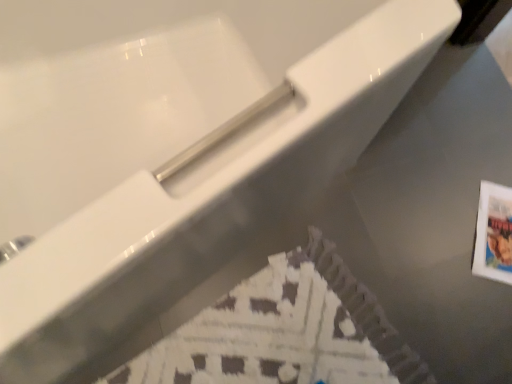
What do you see at coordinates (493, 234) in the screenshot? This screenshot has width=512, height=384. I see `printed paper postcard at lower right` at bounding box center [493, 234].

Find the location of a particular element. printed paper postcard at lower right is located at coordinates coord(493,234).

This screenshot has height=384, width=512. In order to click on white paper flyer at lower center in this screenshot , I will do `click(284, 332)`.

What do you see at coordinates (284, 332) in the screenshot?
I see `white paper flyer at lower center` at bounding box center [284, 332].

Find the location of a particular element. This screenshot has width=512, height=384. printed paper postcard at lower right is located at coordinates [x=493, y=234].

Does white paper flyer at lower center appear on the left side of printed paper postcard at lower right?

Yes, white paper flyer at lower center is to the left of printed paper postcard at lower right.

Between white paper flyer at lower center and printed paper postcard at lower right, which one is positioned in front?

white paper flyer at lower center is closer to the camera.

Considering the positions of point (318, 302) and point (489, 255), is point (318, 302) closer or farther from the camera than point (489, 255)?

Clearly, point (318, 302) is closer to the camera than point (489, 255).

From the image's perspective, which one is positioned higher, white paper flyer at lower center or printed paper postcard at lower right?

printed paper postcard at lower right, from the image's perspective.

From a real-world perspective, relative to printed paper postcard at lower right, is white paper flyer at lower center vertically above or below?

Clearly, from a real-world perspective, white paper flyer at lower center is above printed paper postcard at lower right.

Is white paper flyer at lower center thinner than printed paper postcard at lower right?

No.

Is white paper flyer at lower center taller than printed paper postcard at lower right?

Yes, white paper flyer at lower center is taller than printed paper postcard at lower right.

Considering the sizes of white paper flyer at lower center and printed paper postcard at lower right in the image, is white paper flyer at lower center bigger or smaller than printed paper postcard at lower right?

Considering their sizes, white paper flyer at lower center takes up more space than printed paper postcard at lower right.

Is printed paper postcard at lower right located within white paper flyer at lower center?

No, printed paper postcard at lower right is not inside white paper flyer at lower center.

Is white paper flyer at lower center placed right next to printed paper postcard at lower right?

white paper flyer at lower center is not next to printed paper postcard at lower right, and they're not touching.

Is white paper flyer at lower center turned away from printed paper postcard at lower right?

white paper flyer at lower center is not turned away from printed paper postcard at lower right.

Measure the distance from white paper flyer at lower center to printed paper postcard at lower right.

A distance of 21.31 inches exists between white paper flyer at lower center and printed paper postcard at lower right.

Locate an element on the screen. Image resolution: width=512 pixels, height=384 pixels. postcard below the white paper flyer at lower center (from a real-world perspective) is located at coordinates (493, 234).

Is printed paper postcard at lower right at the left side of white paper flyer at lower center?

No, printed paper postcard at lower right is not to the left of white paper flyer at lower center.

Does printed paper postcard at lower right come behind white paper flyer at lower center?

That is True.

Does point (506, 254) appear closer or farther from the camera than point (185, 378)?

Point (506, 254) is positioned farther from the camera compared to point (185, 378).

From the picture: From the image's perspective, is printed paper postcard at lower right above white paper flyer at lower center?

Correct, printed paper postcard at lower right appears higher than white paper flyer at lower center in the image.

From a real-world perspective, who is located higher, printed paper postcard at lower right or white paper flyer at lower center?

In real-world perspective, white paper flyer at lower center is above.

In terms of width, does printed paper postcard at lower right look wider or thinner when compared to white paper flyer at lower center?

In the image, printed paper postcard at lower right appears to be more narrow than white paper flyer at lower center.

Considering the relative sizes of printed paper postcard at lower right and white paper flyer at lower center in the image provided, is printed paper postcard at lower right shorter than white paper flyer at lower center?

Correct, printed paper postcard at lower right is not as tall as white paper flyer at lower center.

Considering the sizes of objects printed paper postcard at lower right and white paper flyer at lower center in the image provided, who is smaller, printed paper postcard at lower right or white paper flyer at lower center?

With smaller size is printed paper postcard at lower right.

Would you say printed paper postcard at lower right is inside or outside white paper flyer at lower center?

printed paper postcard at lower right exists outside the volume of white paper flyer at lower center.

Is printed paper postcard at lower right not near white paper flyer at lower center?

No, there isn't a large distance between printed paper postcard at lower right and white paper flyer at lower center.

Is printed paper postcard at lower right facing towards white paper flyer at lower center?

No, printed paper postcard at lower right does not turn towards white paper flyer at lower center.

This screenshot has height=384, width=512. I want to click on flyer below the printed paper postcard at lower right (from the image's perspective), so click(284, 332).

Find the location of a particular element. This screenshot has width=512, height=384. flyer in front of the printed paper postcard at lower right is located at coordinates (284, 332).

Locate an element on the screen. The width and height of the screenshot is (512, 384). postcard located underneath the white paper flyer at lower center (from a real-world perspective) is located at coordinates (493, 234).